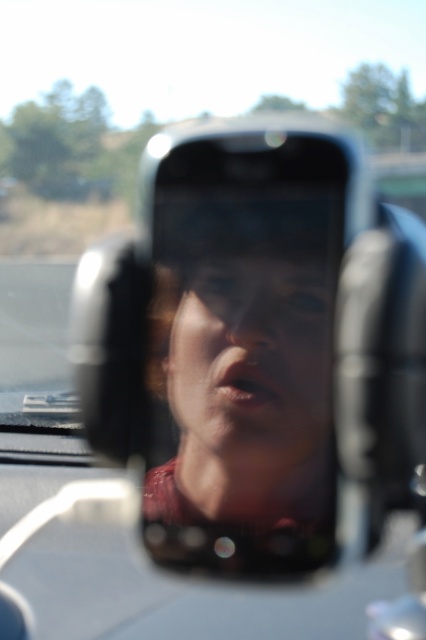
Is matte black phone at center shorter than smooth skin face at center?

Incorrect, matte black phone at center's height does not fall short of smooth skin face at center's.

Between matte black phone at center and smooth skin face at center, which one appears on the left side from the viewer's perspective?

From the viewer's perspective, matte black phone at center appears more on the left side.

In order to click on matte black phone at center in this screenshot , I will do `click(245, 381)`.